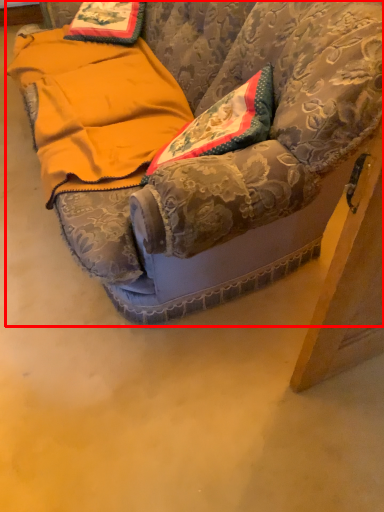
Question: In this image, where is furniture (annotated by the red box) located relative to blanket?

Choices:
 (A) left
 (B) right

Answer: (B)